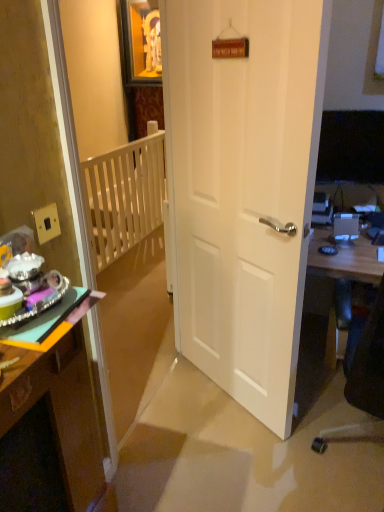
Locate an element on the screen. free space to the left of white matte door at center is located at coordinates (184, 401).